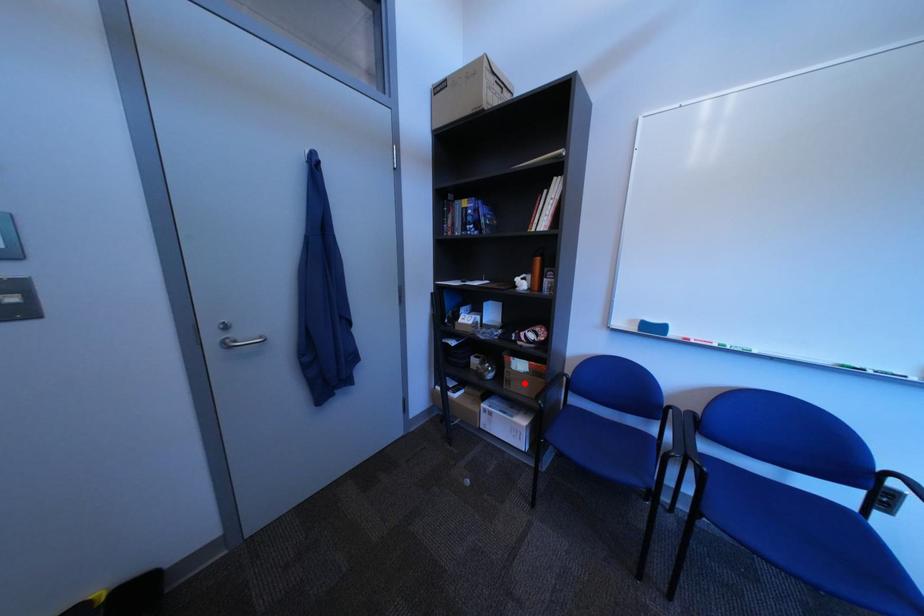
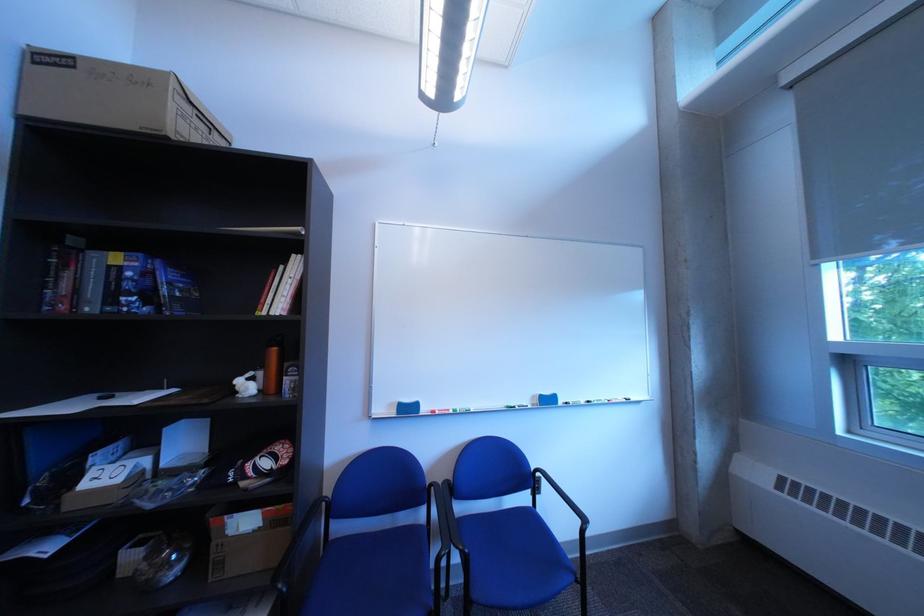
Find the pixel in the second image that matches the highlighted location in the first image.

(237, 565)